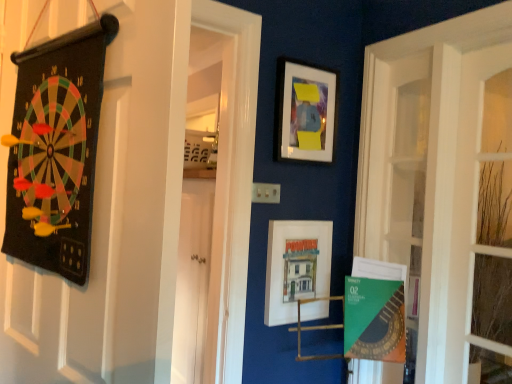
Find the location of a particular element. black felt dartboard at left is located at coordinates (135, 195).

You are a GUI agent. You are given a task and a screenshot of the screen. Output one action in this format:
    pyautogui.click(x=<x>, y=<y>)
    Task: Click on the green paper at lower right
    
    Given the screenshot: What is the action you would take?
    pyautogui.click(x=374, y=319)

Describe the element at coordinates (305, 111) in the screenshot. I see `matte white picture frame at upper center, marked as the second picture frame in a bottom-to-top arrangement` at that location.

In order to face clear glass window at right, should I rotate leftwards or rightwards?

To face it directly, rotate right by 28.293 degrees.

Locate an element on the screen. black felt dartboard at left is located at coordinates (135, 195).

Between matte white picture frame at upper center, marked as the second picture frame in a bottom-to-top arrangement, and black felt dartboard at left, which one appears on the left side from the viewer's perspective?

black felt dartboard at left is more to the left.

Who is bigger, matte white picture frame at upper center, marked as the second picture frame in a bottom-to-top arrangement, or black felt dartboard at left?

black felt dartboard at left.

From the image's perspective, is matte white picture frame at upper center, the 1th picture frame positioned from the top, under black felt dartboard at left?

Actually, matte white picture frame at upper center, the 1th picture frame positioned from the top, appears above black felt dartboard at left in the image.

Based on the photo, is matte white picture frame at upper center, marked as the second picture frame in a bottom-to-top arrangement, taller than black felt dartboard at left?

No.

In the scene shown: From a real-world perspective, which object stands above the other?

matte white picture frame at center, arranged as the first picture frame when ordered from the bottom, is physically above.

Does matte white picture frame at center, arranged as the first picture frame when ordered from the bottom, turn towards green paper at lower right?

Yes, matte white picture frame at center, arranged as the first picture frame when ordered from the bottom, is facing green paper at lower right.

This screenshot has width=512, height=384. I want to click on the 2nd picture frame counting from the left of the green paper at lower right, so click(x=296, y=267).

From the image's perspective, which is below, matte white picture frame at center, arranged as the 2th picture frame when viewed from the top, or green paper at lower right?

green paper at lower right, from the image's perspective.

From a real-world perspective, is matte white picture frame at center, arranged as the first picture frame when ordered from the bottom, below black felt dartboard at left?

Yes, from a real-world perspective, matte white picture frame at center, arranged as the first picture frame when ordered from the bottom, is under black felt dartboard at left.

Could you tell me if matte white picture frame at center, arranged as the first picture frame when ordered from the bottom, is facing black felt dartboard at left?

No, matte white picture frame at center, arranged as the first picture frame when ordered from the bottom, is not oriented towards black felt dartboard at left.

Can you confirm if matte white picture frame at center, arranged as the first picture frame when ordered from the bottom, is shorter than black felt dartboard at left?

Indeed, matte white picture frame at center, arranged as the first picture frame when ordered from the bottom, has a lesser height compared to black felt dartboard at left.

From a real-world perspective, which is physically above, black felt dartboard at left or matte white picture frame at upper center, the 1th picture frame positioned from the top?

matte white picture frame at upper center, the 1th picture frame positioned from the top, is physically above.

Considering the positions of objects black felt dartboard at left and matte white picture frame at upper center, the 1th picture frame positioned from the top, in the image provided, who is more to the left, black felt dartboard at left or matte white picture frame at upper center, the 1th picture frame positioned from the top,?

black felt dartboard at left is more to the left.

Considering the relative sizes of black felt dartboard at left and matte white picture frame at upper center, marked as the second picture frame in a bottom-to-top arrangement, in the image provided, is black felt dartboard at left bigger than matte white picture frame at upper center, marked as the second picture frame in a bottom-to-top arrangement,?

Yes.

I want to click on picture frame lying behind the matte white picture frame at center, arranged as the 2th picture frame when viewed from the top, so click(x=305, y=111).

Does point (317, 74) come closer to viewer compared to point (303, 253)?

That is False.

From the picture: Is matte white picture frame at upper center, marked as the second picture frame in a bottom-to-top arrangement, bigger than matte white picture frame at center, arranged as the first picture frame when ordered from the bottom?

No, matte white picture frame at upper center, marked as the second picture frame in a bottom-to-top arrangement, is not bigger than matte white picture frame at center, arranged as the first picture frame when ordered from the bottom.

Measure the distance between clear glass window at right and matte white picture frame at center, arranged as the first picture frame when ordered from the bottom.

The distance of clear glass window at right from matte white picture frame at center, arranged as the first picture frame when ordered from the bottom, is 3.50 feet.

Can you see clear glass window at right touching matte white picture frame at center, arranged as the 2th picture frame when viewed from the top?

No.

From the image's perspective, is clear glass window at right above or below matte white picture frame at center, arranged as the first picture frame when ordered from the bottom?

From the image's perspective, clear glass window at right appears above matte white picture frame at center, arranged as the first picture frame when ordered from the bottom.

Does clear glass window at right come in front of matte white picture frame at center, arranged as the first picture frame when ordered from the bottom?

Yes, clear glass window at right is in front of matte white picture frame at center, arranged as the first picture frame when ordered from the bottom.

From a real-world perspective, which object stands above the other?

In real-world perspective, black felt dartboard at left is above.

How many degrees apart are the facing directions of green paper at lower right and black felt dartboard at left?

28.7 degrees separate the facing orientations of green paper at lower right and black felt dartboard at left.

Is black felt dartboard at left at the back of green paper at lower right?

No.

From the picture: Does green paper at lower right have a lesser height compared to black felt dartboard at left?

Yes.

You are a GUI agent. You are given a task and a screenshot of the screen. Output one action in this format:
    pyautogui.click(x=<x>, y=<y>)
    Task: Click on the 2nd picture frame behind the black felt dartboard at left
    The width and height of the screenshot is (512, 384).
    Given the screenshot: What is the action you would take?
    pyautogui.click(x=305, y=111)

Find the location of a particular element. Image resolution: width=512 pixels, height=384 pixels. postcard on the right of matte white picture frame at center, arranged as the 2th picture frame when viewed from the top is located at coordinates (374, 319).

In the scene shown: From the image, which object appears to be farther from matte white picture frame at center, arranged as the 2th picture frame when viewed from the top, green paper at lower right or clear glass window at right?

clear glass window at right.

Looking at the image, which one is located closer to black felt dartboard at left, matte white picture frame at center, arranged as the first picture frame when ordered from the bottom, or matte white picture frame at upper center, the 1th picture frame positioned from the top?

matte white picture frame at center, arranged as the first picture frame when ordered from the bottom, lies closer to black felt dartboard at left than the other object.

Estimate the real-world distances between objects in this image. Which object is closer to matte white picture frame at center, arranged as the first picture frame when ordered from the bottom, green paper at lower right or matte white picture frame at upper center, the 1th picture frame positioned from the top?

green paper at lower right.

In the scene shown: When comparing their distances from green paper at lower right, does clear glass window at right or matte white picture frame at upper center, marked as the second picture frame in a bottom-to-top arrangement, seem further?

clear glass window at right.

Looking at the image, which one is located further to clear glass window at right, matte white picture frame at upper center, the 1th picture frame positioned from the top, or black felt dartboard at left?

black felt dartboard at left.

Considering their positions, is matte white picture frame at upper center, the 1th picture frame positioned from the top, positioned further to clear glass window at right than matte white picture frame at center, arranged as the 2th picture frame when viewed from the top?

matte white picture frame at center, arranged as the 2th picture frame when viewed from the top, is further to clear glass window at right.

When comparing their distances from black felt dartboard at left, does clear glass window at right or matte white picture frame at center, arranged as the 2th picture frame when viewed from the top, seem further?

clear glass window at right is further to black felt dartboard at left.

Based on their spatial positions, is black felt dartboard at left or clear glass window at right closer to matte white picture frame at center, arranged as the first picture frame when ordered from the bottom?

black felt dartboard at left.

Locate an element on the screen. The height and width of the screenshot is (384, 512). postcard between matte white picture frame at center, arranged as the 2th picture frame when viewed from the top, and clear glass window at right from left to right is located at coordinates (374, 319).

You are a GUI agent. You are given a task and a screenshot of the screen. Output one action in this format:
    pyautogui.click(x=<x>, y=<y>)
    Task: Click on the postcard between black felt dartboard at left and matte white picture frame at upper center, the 1th picture frame positioned from the top, along the z-axis
    This screenshot has height=384, width=512.
    Given the screenshot: What is the action you would take?
    pyautogui.click(x=374, y=319)

This screenshot has height=384, width=512. I want to click on postcard located between black felt dartboard at left and clear glass window at right in the left-right direction, so click(374, 319).

At what (x,y) coordinates should I click in order to perform the action: click on picture frame between black felt dartboard at left and matte white picture frame at upper center, marked as the second picture frame in a bottom-to-top arrangement, along the z-axis. Please return your answer as a coordinate pair (x, y). The height and width of the screenshot is (384, 512). Looking at the image, I should click on (296, 267).